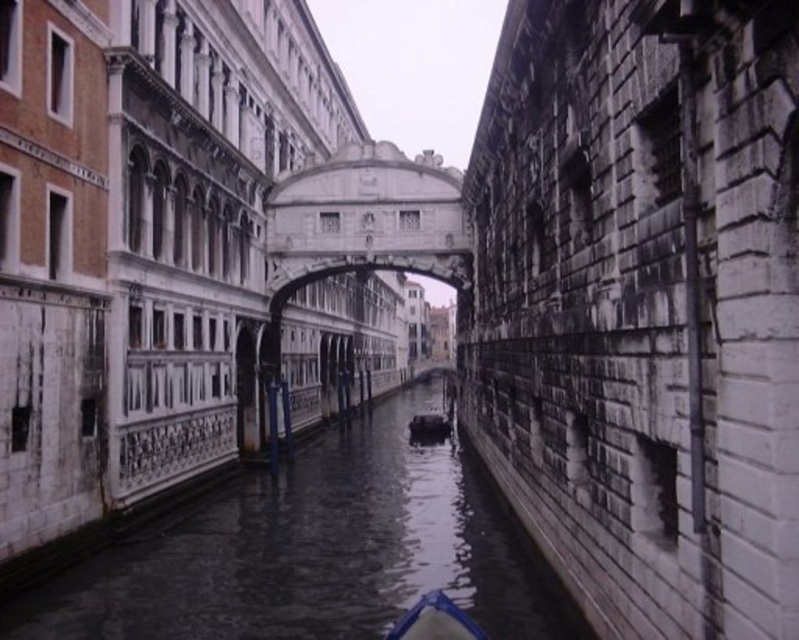
Consider the image. You are a tour guide leading a group through Venice. You want to ensure everyone can see both the smooth stone canal at center and the white stone bridge at center clearly. Given that the average human field of view is about 120 degrees horizontally, can your group view both objects simultaneously without moving their heads?

The smooth stone canal at center and white stone bridge at center are 37.09 meters apart. Since the distance between them is greater than the field of view of 120 degrees, the group cannot view both objects simultaneously without moving their heads.

You are a tourist in Venice and want to take a photo of the Bridge of Sighs reflected in the water. The smooth stone canal at center and the blue plastic boat at center are in your view. Which object should be in the foreground to ensure the reflection is clear?

The smooth stone canal at center should be in the foreground because the blue plastic boat at center is behind it, allowing the water surface of the canal to remain undisturbed and reflect the Bridge of Sighs clearly.

You are a tourist in Venice, and you see two boats in the canal. The blue plastic boat at center and the black rubber boat at center. Which boat is closer to the water surface?

The blue plastic boat at center is located below the black rubber boat at center, so the blue plastic boat at center is closer to the water surface.